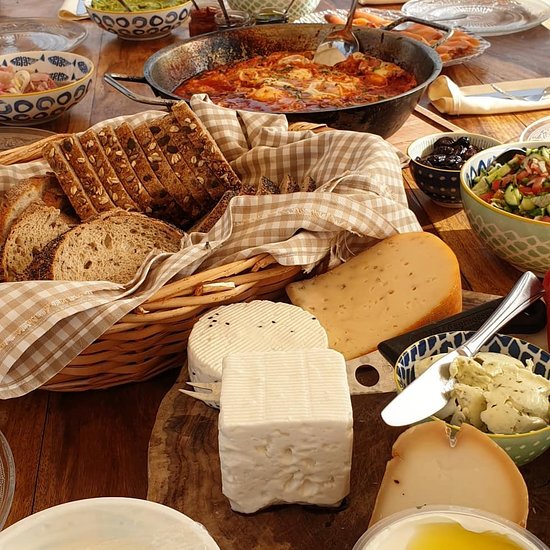
I want to click on black handle, so click(478, 314).